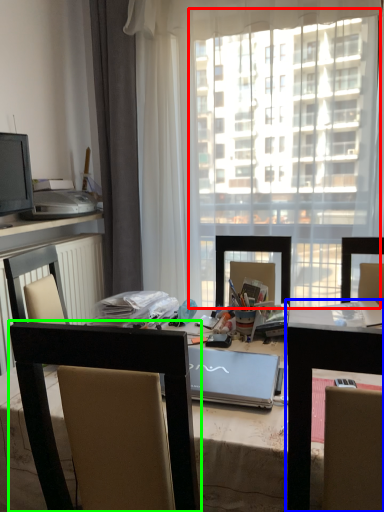
Question: Which object is the closest to the window screen (highlighted by a red box)? Choose among these: table (highlighted by a blue box) or chair (highlighted by a green box).

Choices:
 (A) table
 (B) chair

Answer: (A)